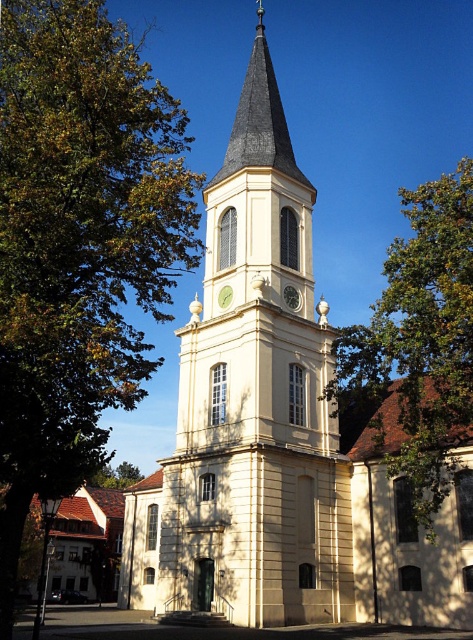
You are standing in front of the church and notice a point marked at coordinates (78, 243). Based on the church description, what object is located at that point?

The point at coordinates (78, 243) corresponds to the green leafy tree at upper left.

You are standing at the center of the image and want to locate the beige stone clock tower at center. What are its coordinates?

The beige stone clock tower at center is located at coordinates point [256,397].